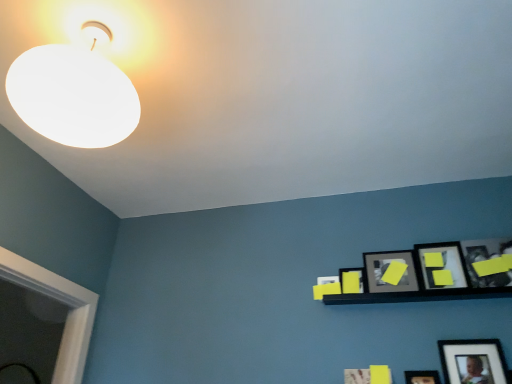
Describe the element at coordinates (489, 262) in the screenshot. The height and width of the screenshot is (384, 512). I see `yellow matte picture frame at upper right, the first picture frame in the right-to-left sequence` at that location.

What do you see at coordinates (442, 266) in the screenshot?
I see `yellow matte picture frame at upper right, the third picture frame positioned from the left` at bounding box center [442, 266].

Identify the location of white matte lampshade at upper left. (74, 93).

You are a GUI agent. You are given a task and a screenshot of the screen. Output one action in this format:
    pyautogui.click(x=<x>, y=<y>)
    Task: Click on the yellow matte picture frame at upper right, the first picture frame viewed from the left
    
    Given the screenshot: What is the action you would take?
    pyautogui.click(x=351, y=280)

From a real-world perspective, does yellow matte picture frame at upper right, placed as the 3th picture frame when sorted from right to left, stand above yellow matte picture frame at upper right, the first picture frame viewed from the left?

Yes, from a real-world perspective, yellow matte picture frame at upper right, placed as the 3th picture frame when sorted from right to left, is on top of yellow matte picture frame at upper right, the first picture frame viewed from the left.

From the image's perspective, between yellow matte picture frame at upper right, placed as the 3th picture frame when sorted from right to left, and yellow matte picture frame at upper right, the fifth picture frame when ordered from right to left, which one is located above?

yellow matte picture frame at upper right, placed as the 3th picture frame when sorted from right to left.

In terms of height, does yellow matte picture frame at upper right, placed as the 3th picture frame when sorted from right to left, look taller or shorter compared to yellow matte picture frame at upper right, the fifth picture frame when ordered from right to left?

In the image, yellow matte picture frame at upper right, placed as the 3th picture frame when sorted from right to left, appears to be taller than yellow matte picture frame at upper right, the fifth picture frame when ordered from right to left.

In terms of width, does yellow matte picture frame at upper right, the third picture frame positioned from the left, look wider or thinner when compared to yellow matte picture frame at upper right, the first picture frame viewed from the left?

In the image, yellow matte picture frame at upper right, the third picture frame positioned from the left, appears to be wider than yellow matte picture frame at upper right, the first picture frame viewed from the left.

Is yellow matte picture frame at upper right, the first picture frame viewed from the left, situated inside matte black picture frame at upper right, which ranks as the fourth picture frame in right-to-left order, or outside?

yellow matte picture frame at upper right, the first picture frame viewed from the left, is spatially situated outside matte black picture frame at upper right, which ranks as the fourth picture frame in right-to-left order.

From the image's perspective, is yellow matte picture frame at upper right, the first picture frame viewed from the left, below matte black picture frame at upper right, which ranks as the fourth picture frame in right-to-left order?

Yes, from the image's perspective, yellow matte picture frame at upper right, the first picture frame viewed from the left, is below matte black picture frame at upper right, which ranks as the fourth picture frame in right-to-left order.

Which of these two, yellow matte picture frame at upper right, the first picture frame viewed from the left, or matte black picture frame at upper right, placed as the 2th picture frame when sorted from left to right, is thinner?

With smaller width is yellow matte picture frame at upper right, the first picture frame viewed from the left.

Which of these two, yellow matte picture frame at upper right, the fifth picture frame when ordered from right to left, or matte black picture frame at upper right, which ranks as the fourth picture frame in right-to-left order, is bigger?

Bigger between the two is matte black picture frame at upper right, which ranks as the fourth picture frame in right-to-left order.

From a real-world perspective, who is located higher, yellow matte picture frame at upper right, the first picture frame in the right-to-left sequence, or white matte lampshade at upper left?

white matte lampshade at upper left.

In terms of height, does yellow matte picture frame at upper right, which is the fifth picture frame from left to right, look taller or shorter compared to white matte lampshade at upper left?

yellow matte picture frame at upper right, which is the fifth picture frame from left to right, is shorter than white matte lampshade at upper left.

Looking at the image, does yellow matte picture frame at upper right, the first picture frame in the right-to-left sequence, seem bigger or smaller compared to white matte lampshade at upper left?

In the image, yellow matte picture frame at upper right, the first picture frame in the right-to-left sequence, appears to be smaller than white matte lampshade at upper left.

Would you consider yellow matte picture frame at upper right, the first picture frame in the right-to-left sequence, to be distant from white matte lampshade at upper left?

yellow matte picture frame at upper right, the first picture frame in the right-to-left sequence, is positioned a significant distance from white matte lampshade at upper left.

From a real-world perspective, is matte black picture frame at upper right, which ranks as the fourth picture frame in right-to-left order, on top of yellow matte picture frame at upper right, the first picture frame viewed from the left?

Yes, from a real-world perspective, matte black picture frame at upper right, which ranks as the fourth picture frame in right-to-left order, is on top of yellow matte picture frame at upper right, the first picture frame viewed from the left.

Based on the photo, choose the correct answer: Is matte black picture frame at upper right, which ranks as the fourth picture frame in right-to-left order, inside yellow matte picture frame at upper right, the fifth picture frame when ordered from right to left, or outside it?

matte black picture frame at upper right, which ranks as the fourth picture frame in right-to-left order, is located beyond the bounds of yellow matte picture frame at upper right, the fifth picture frame when ordered from right to left.

Is point (369, 292) farther from camera compared to point (358, 281)?

No, (369, 292) is in front of (358, 281).

From the image's perspective, who appears lower, matte black picture frame at upper right, which ranks as the fourth picture frame in right-to-left order, or yellow matte picture frame at upper right, the first picture frame viewed from the left?

From the image's view, yellow matte picture frame at upper right, the first picture frame viewed from the left, is below.

Is white matte lampshade at upper left facing towards yellow matte picture frame at upper right, which is the fifth picture frame from left to right?

No, white matte lampshade at upper left does not turn towards yellow matte picture frame at upper right, which is the fifth picture frame from left to right.

Would you say white matte lampshade at upper left is a long distance from yellow matte picture frame at upper right, which is the fifth picture frame from left to right?

That's right, there is a large distance between white matte lampshade at upper left and yellow matte picture frame at upper right, which is the fifth picture frame from left to right.

Between white matte lampshade at upper left and yellow matte picture frame at upper right, which is the fifth picture frame from left to right, which one has larger width?

white matte lampshade at upper left.

Would you consider matte black picture frame at upper right, placed as the 2th picture frame when sorted from left to right, to be distant from white matte lampshade at upper left?

matte black picture frame at upper right, placed as the 2th picture frame when sorted from left to right, is positioned a significant distance from white matte lampshade at upper left.

Who is smaller, matte black picture frame at upper right, placed as the 2th picture frame when sorted from left to right, or white matte lampshade at upper left?

matte black picture frame at upper right, placed as the 2th picture frame when sorted from left to right, is smaller.

Based on the photo, is matte black picture frame at upper right, which ranks as the fourth picture frame in right-to-left order, turned away from white matte lampshade at upper left?

matte black picture frame at upper right, which ranks as the fourth picture frame in right-to-left order, does not have its back to white matte lampshade at upper left.

Where is `lamp on the left side of matte black picture frame at upper right, placed as the 2th picture frame when sorted from left to right`? This screenshot has height=384, width=512. lamp on the left side of matte black picture frame at upper right, placed as the 2th picture frame when sorted from left to right is located at coordinates (74, 93).

Is matte black picture frame at lower right, the second picture frame in the right-to-left sequence, wider than matte black picture frame at upper right, placed as the 2th picture frame when sorted from left to right?

No, matte black picture frame at lower right, the second picture frame in the right-to-left sequence, is not wider than matte black picture frame at upper right, placed as the 2th picture frame when sorted from left to right.

How far apart are matte black picture frame at lower right, the second picture frame in the right-to-left sequence, and matte black picture frame at upper right, which ranks as the fourth picture frame in right-to-left order?

14.13 inches.

Is matte black picture frame at lower right, positioned as the fourth picture frame in left-to-right order, in front of or behind matte black picture frame at upper right, placed as the 2th picture frame when sorted from left to right, in the image?

In the image, matte black picture frame at lower right, positioned as the fourth picture frame in left-to-right order, appears in front of matte black picture frame at upper right, placed as the 2th picture frame when sorted from left to right.

Where is `picture frame that is the 2nd object located below the yellow matte picture frame at upper right, the third picture frame positioned from the left (from the image's perspective)`? picture frame that is the 2nd object located below the yellow matte picture frame at upper right, the third picture frame positioned from the left (from the image's perspective) is located at coordinates (351, 280).

This screenshot has height=384, width=512. I want to click on the 1st picture frame counting from the right side of the yellow matte picture frame at upper right, the first picture frame viewed from the left, so click(x=390, y=271).

Based on the photo, which object lies nearer to the anchor point matte black picture frame at upper right, placed as the 2th picture frame when sorted from left to right, yellow matte picture frame at upper right, the first picture frame viewed from the left, or yellow matte picture frame at upper right, the first picture frame in the right-to-left sequence?

Based on the image, yellow matte picture frame at upper right, the first picture frame viewed from the left, appears to be nearer to matte black picture frame at upper right, placed as the 2th picture frame when sorted from left to right.

Estimate the real-world distances between objects in this image. Which object is further from yellow matte picture frame at upper right, the first picture frame viewed from the left, yellow matte picture frame at upper right, which is the fifth picture frame from left to right, or matte black picture frame at upper right, placed as the 2th picture frame when sorted from left to right?

Among the two, yellow matte picture frame at upper right, which is the fifth picture frame from left to right, is located further to yellow matte picture frame at upper right, the first picture frame viewed from the left.

When comparing their distances from yellow matte picture frame at upper right, the third picture frame positioned from the left, does yellow matte picture frame at upper right, the first picture frame in the right-to-left sequence, or yellow matte picture frame at upper right, the fifth picture frame when ordered from right to left, seem further?

yellow matte picture frame at upper right, the fifth picture frame when ordered from right to left, lies further to yellow matte picture frame at upper right, the third picture frame positioned from the left, than the other object.

Based on their spatial positions, is yellow matte picture frame at upper right, which is the fifth picture frame from left to right, or matte black picture frame at upper right, which ranks as the fourth picture frame in right-to-left order, further from matte black picture frame at lower right, the second picture frame in the right-to-left sequence?

matte black picture frame at upper right, which ranks as the fourth picture frame in right-to-left order, lies further to matte black picture frame at lower right, the second picture frame in the right-to-left sequence, than the other object.

Estimate the real-world distances between objects in this image. Which object is closer to yellow matte picture frame at upper right, the fifth picture frame when ordered from right to left, yellow matte picture frame at upper right, the third picture frame positioned from the left, or white matte lampshade at upper left?

yellow matte picture frame at upper right, the third picture frame positioned from the left, is closer to yellow matte picture frame at upper right, the fifth picture frame when ordered from right to left.

Based on their spatial positions, is white matte lampshade at upper left or yellow matte picture frame at upper right, the first picture frame viewed from the left, further from matte black picture frame at lower right, positioned as the fourth picture frame in left-to-right order?

Based on the image, white matte lampshade at upper left appears to be further to matte black picture frame at lower right, positioned as the fourth picture frame in left-to-right order.

Based on their spatial positions, is matte black picture frame at upper right, placed as the 2th picture frame when sorted from left to right, or yellow matte picture frame at upper right, the fifth picture frame when ordered from right to left, further from white matte lampshade at upper left?

Among the two, matte black picture frame at upper right, placed as the 2th picture frame when sorted from left to right, is located further to white matte lampshade at upper left.

Based on their spatial positions, is yellow matte picture frame at upper right, which is the fifth picture frame from left to right, or matte black picture frame at lower right, positioned as the fourth picture frame in left-to-right order, further from yellow matte picture frame at upper right, the first picture frame viewed from the left?

yellow matte picture frame at upper right, which is the fifth picture frame from left to right, lies further to yellow matte picture frame at upper right, the first picture frame viewed from the left, than the other object.

Identify the location of picture frame between white matte lampshade at upper left and matte black picture frame at upper right, placed as the 2th picture frame when sorted from left to right, in the horizontal direction. (351, 280).

Where is `picture frame between yellow matte picture frame at upper right, the first picture frame viewed from the left, and yellow matte picture frame at upper right, the third picture frame positioned from the left, from left to right`? picture frame between yellow matte picture frame at upper right, the first picture frame viewed from the left, and yellow matte picture frame at upper right, the third picture frame positioned from the left, from left to right is located at coordinates (390, 271).